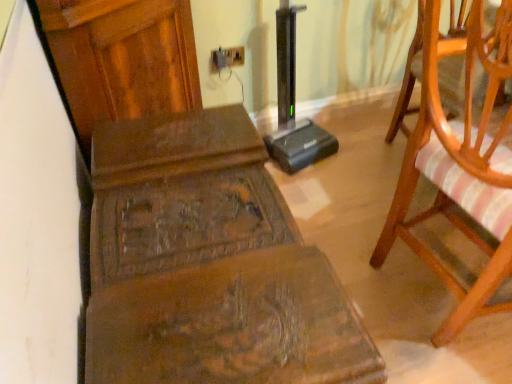
Locate an element on the screen. This screenshot has width=512, height=384. wooden chair with striped cushion at right is located at coordinates (460, 169).

What do you see at coordinates (208, 265) in the screenshot? I see `wooden carved bench at center` at bounding box center [208, 265].

This screenshot has height=384, width=512. In order to click on wooden chair with striped cushion at right in this screenshot , I will do `click(460, 169)`.

Based on their positions, is wooden carved bench at center located to the left or right of wooden chair with striped cushion at right?

wooden carved bench at center is positioned on wooden chair with striped cushion at right's left side.

Is wooden carved bench at center turned away from wooden chair with striped cushion at right?

wooden carved bench at center is not turned away from wooden chair with striped cushion at right.

From the image's perspective, is wooden carved bench at center on wooden chair with striped cushion at right?

No, from the image's perspective, wooden carved bench at center is not above wooden chair with striped cushion at right.

Where is `chair located in front of the wooden carved bench at center`? The height and width of the screenshot is (384, 512). chair located in front of the wooden carved bench at center is located at coordinates (460, 169).

Between wooden carved bench at center and matte plastic electric outlet at upper center, which one appears on the left side from the viewer's perspective?

From the viewer's perspective, wooden carved bench at center appears more on the left side.

Is wooden carved bench at center in contact with matte plastic electric outlet at upper center?

No.

Is wooden carved bench at center wider or thinner than matte plastic electric outlet at upper center?

wooden carved bench at center is wider than matte plastic electric outlet at upper center.

Is wooden chair with striped cushion at right far away from wooden carved bench at center?

No, wooden chair with striped cushion at right is not far away from wooden carved bench at center.

Would you say wooden carved bench at center is part of wooden chair with striped cushion at right's contents?

That's incorrect, wooden carved bench at center is not inside wooden chair with striped cushion at right.

Does wooden chair with striped cushion at right have a larger size compared to wooden carved bench at center?

Yes.

Considering the sizes of objects wooden chair with striped cushion at right and wooden carved bench at center in the image provided, who is shorter, wooden chair with striped cushion at right or wooden carved bench at center?

With less height is wooden carved bench at center.

Locate an element on the screen. Image resolution: width=512 pixels, height=384 pixels. chair positioned vertically above the matte plastic electric outlet at upper center (from a real-world perspective) is located at coordinates (460, 169).

From the image's perspective, is wooden chair with striped cushion at right above or below matte plastic electric outlet at upper center?

Clearly, from the image's perspective, wooden chair with striped cushion at right is below matte plastic electric outlet at upper center.

Is wooden chair with striped cushion at right looking in the opposite direction of matte plastic electric outlet at upper center?

No, matte plastic electric outlet at upper center is not at the back of wooden chair with striped cushion at right.

How different are the orientations of matte plastic electric outlet at upper center and wooden chair with striped cushion at right in degrees?

There is a 91.2-degree angle between the facing directions of matte plastic electric outlet at upper center and wooden chair with striped cushion at right.

From a real-world perspective, who is located higher, matte plastic electric outlet at upper center or wooden chair with striped cushion at right?

wooden chair with striped cushion at right, from a real-world perspective.

Which point is more distant from viewer, [243,62] or [432,77]?

Point [243,62]

Who is taller, matte plastic electric outlet at upper center or wooden carved bench at center?

Standing taller between the two is wooden carved bench at center.

From a real-world perspective, between matte plastic electric outlet at upper center and wooden carved bench at center, who is vertically higher?

matte plastic electric outlet at upper center is physically above.

Is wooden carved bench at center at the back of matte plastic electric outlet at upper center?

No, matte plastic electric outlet at upper center is not facing the opposite direction of wooden carved bench at center.

From the image's perspective, is matte plastic electric outlet at upper center above or below wooden carved bench at center?

Clearly, from the image's perspective, matte plastic electric outlet at upper center is above wooden carved bench at center.

This screenshot has height=384, width=512. What are the coordinates of `chair on the right side of wooden carved bench at center` in the screenshot? It's located at tap(460, 169).

Image resolution: width=512 pixels, height=384 pixels. In order to click on furniture in front of the matte plastic electric outlet at upper center in this screenshot , I will do `click(208, 265)`.

Looking at the image, which one is located closer to matte plastic electric outlet at upper center, wooden chair with striped cushion at right or wooden carved bench at center?

The object closer to matte plastic electric outlet at upper center is wooden carved bench at center.

Looking at the image, which one is located closer to wooden chair with striped cushion at right, wooden carved bench at center or matte plastic electric outlet at upper center?

wooden carved bench at center is positioned closer to the anchor wooden chair with striped cushion at right.

Estimate the real-world distances between objects in this image. Which object is further from wooden chair with striped cushion at right, matte plastic electric outlet at upper center or wooden carved bench at center?

matte plastic electric outlet at upper center.

Estimate the real-world distances between objects in this image. Which object is further from matte plastic electric outlet at upper center, wooden carved bench at center or wooden chair with striped cushion at right?

wooden chair with striped cushion at right is further to matte plastic electric outlet at upper center.

Considering their positions, is matte plastic electric outlet at upper center positioned further to wooden carved bench at center than wooden chair with striped cushion at right?

Among the two, matte plastic electric outlet at upper center is located further to wooden carved bench at center.

Consider the image. Considering their positions, is wooden chair with striped cushion at right positioned further to wooden carved bench at center than matte plastic electric outlet at upper center?

matte plastic electric outlet at upper center.

Identify the location of furniture between wooden chair with striped cushion at right and matte plastic electric outlet at upper center in the front-back direction. (208, 265).